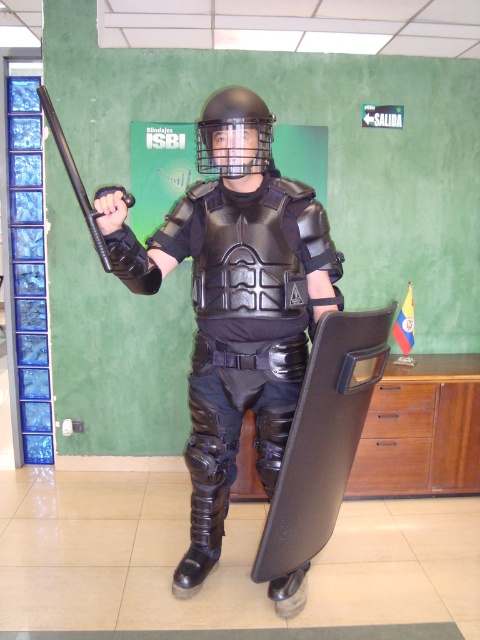
Is point (224, 321) behind point (214, 157)?

That is True.

This screenshot has height=640, width=480. In order to click on matte black armor at center in this screenshot , I will do `click(235, 301)`.

Measure the distance between matte black helmet at center and black rubber baton at left.

matte black helmet at center is 14.86 inches away from black rubber baton at left.

Is matte black helmet at center wider than black rubber baton at left?

Incorrect, matte black helmet at center's width does not surpass black rubber baton at left's.

Which is in front, point (224, 148) or point (128, 193)?

Positioned in front is point (128, 193).

I want to click on matte black helmet at center, so click(x=235, y=134).

Which is below, matte black armor at center or black rubber baton at left?

matte black armor at center is below.

Where is `matte black armor at center`? The width and height of the screenshot is (480, 640). matte black armor at center is located at coordinates (235, 301).